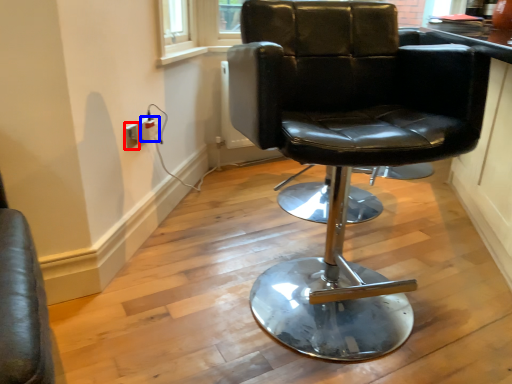
Question: Which point is further to the camera, electric outlet (highlighted by a red box) or electric outlet (highlighted by a blue box)?

Choices:
 (A) electric outlet
 (B) electric outlet

Answer: (B)